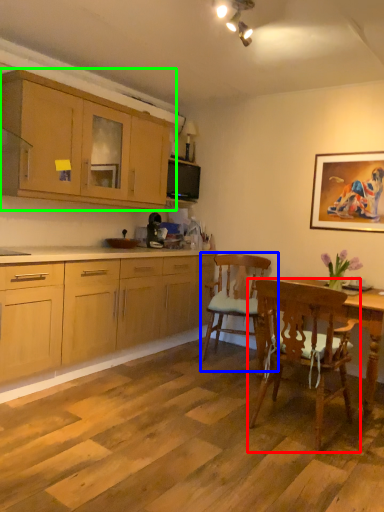
Question: Considering the real-world distances, which object is closest to chair (highlighted by a red box)? chair (highlighted by a blue box) or cabinetry (highlighted by a green box).

Choices:
 (A) chair
 (B) cabinetry

Answer: (A)